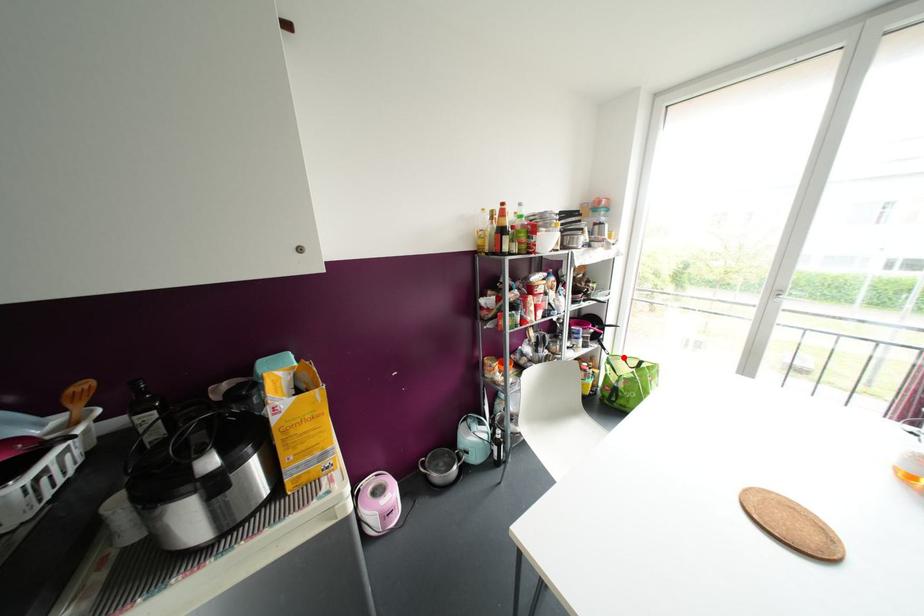
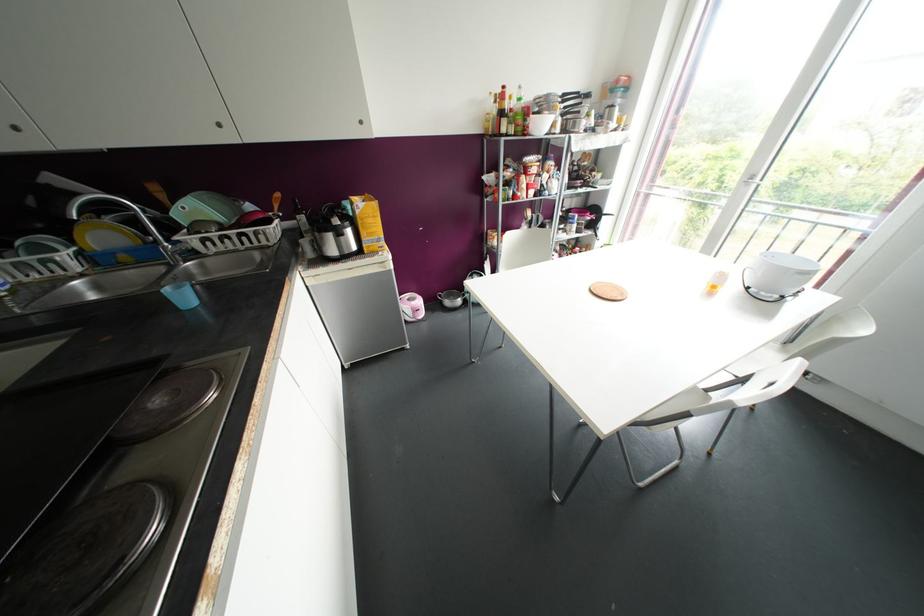
Question: I am providing you with two images of the same scene from different viewpoints. A red point is marked on the first image. At the location where the point appears in image 1, is it still visible in image 2?

Choices:
 (A) Yes
 (B) No

Answer: (B)